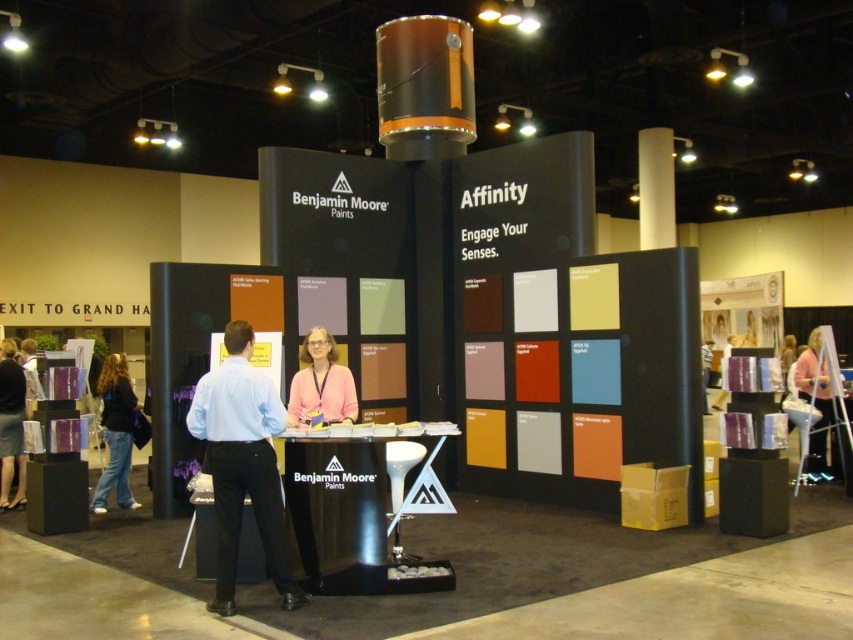
You are at the Benjamin Moore Paints trade show booth. You see a light blue shirt at center and denim jeans at lower left. Which item is positioned to the right of the other?

The light blue shirt at center is positioned to the right of the denim jeans at lower left.

You are standing at the Benjamin Moore Paints trade show booth and want to take a photo of the central display panel. If you are currently at the point labeled point (820,346), which is 8.90 meters away from the display, will you need to move closer to get a clear shot of the Benjamin Moore logo at the top left corner?

The point (820,346) is 8.90 meters away from the camera. Since the logo is part of the central display panel, you are already at a sufficient distance to capture the logo clearly without needing to move closer.

In the scene shown: You are a customer at the Benjamin Moore Paints trade show booth. You see the pink fabric at right and the denim jeans at lower left displayed in the booth. Which object takes up more space in the display?

The pink fabric at right is larger in size than the denim jeans at lower left, so it takes up more space in the display.